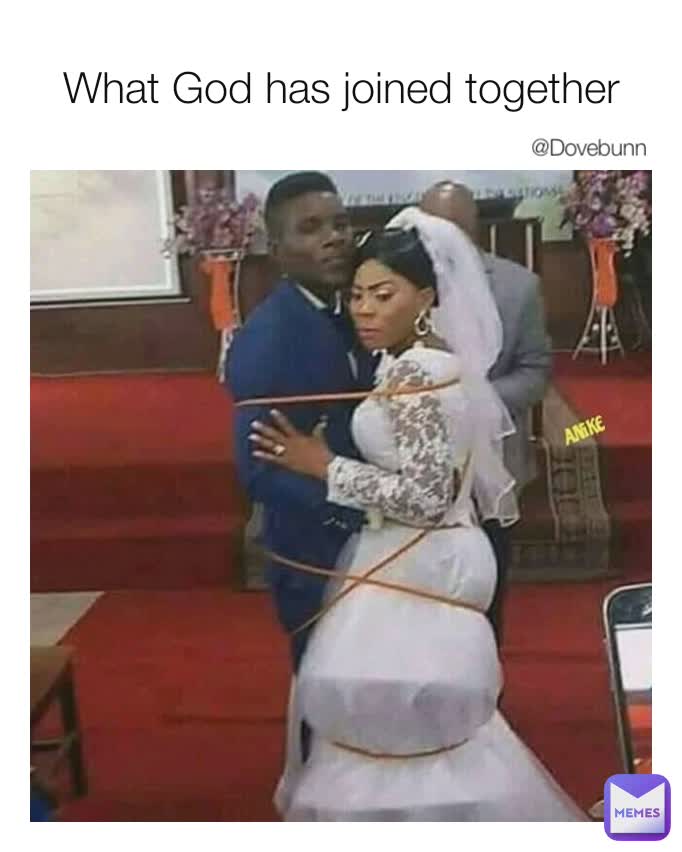
Image resolution: width=682 pixels, height=852 pixels. What are the coordinates of `red carpet` in the screenshot? It's located at (149, 774).